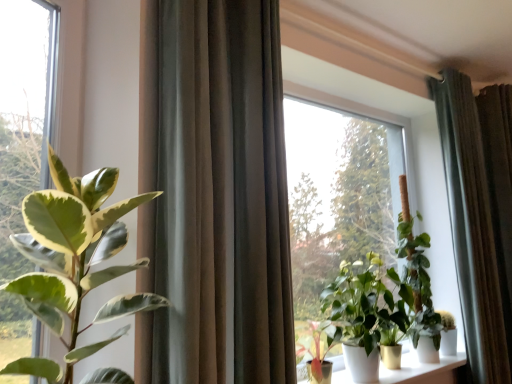
Question: Would you say green matte plant at center, which is the fourth houseplant in front-to-back order, is inside or outside green leafy plant at left?

Choices:
 (A) outside
 (B) inside

Answer: (A)

Question: Considering their positions, is green matte plant at center, which is the fourth houseplant in front-to-back order, located in front of or behind green leafy plant at left?

Choices:
 (A) front
 (B) behind

Answer: (B)

Question: Which is farther from the green matte plant at center, the 1th houseplant from the right?

Choices:
 (A) green matte plant at center, marked as the second houseplant in a front-to-back arrangement
 (B) green leafy plant at left
 (C) satin dark green curtain at right, positioned as the first curtain in right-to-left order
 (D) green glossy plant at center, which appears as the third houseplant when viewed from the left
 (E) satin brown curtain at center, the 2th curtain from the back

Answer: (B)

Question: Which object is the farthest from the satin brown curtain at center, the 2th curtain from the back?

Choices:
 (A) green leafy plant at left
 (B) green matte plant at center, which is the fourth houseplant in front-to-back order
 (C) green matte plant at center, positioned as the third houseplant in right-to-left order
 (D) green glossy plant at center, the 3th houseplant in the front-to-back sequence
 (E) white glossy pots at lower center

Answer: (E)